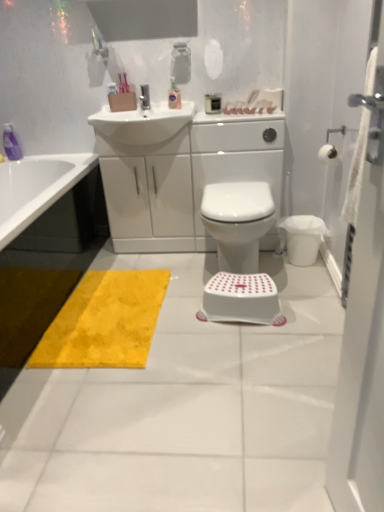
You are a GUI agent. You are given a task and a screenshot of the screen. Output one action in this format:
    pyautogui.click(x=<x>, y=<y>)
    Task: Click on the empty space that is ontop of white plastic step stool at center (from a real-world perspective)
    
    Given the screenshot: What is the action you would take?
    pyautogui.click(x=237, y=283)